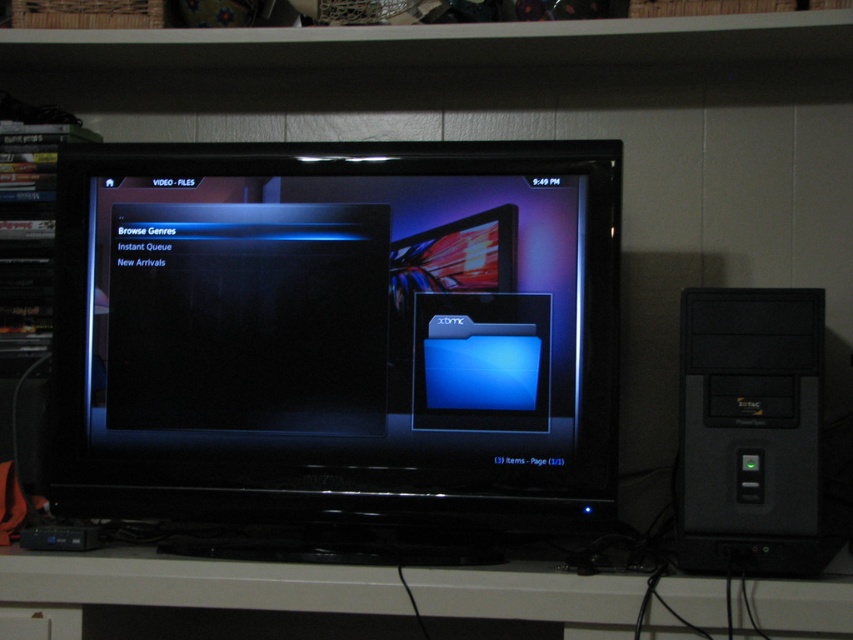
You are standing in front of the home entertainment setup and need to place a new device on the white matte computer desk at lower center. Given that the desk is at coordinates point (196, 582), can you confirm if there is enough space for the device?

The point (196, 582) marks the white matte computer desk at lower center, so yes, there is space available on the desk to place the new device.

You are setting up a home theater system and need to place a large AV receiver between the black glossy monitor at center and the black plastic desktop computer at right. Given that the AV receiver is 20 inches wide, can it fit in the space between them?

The black glossy monitor at center is larger than the black plastic desktop computer at right, but the description does not provide specific measurements of the space between them. Without knowing the exact distance, it is impossible to determine if the AV receiver will fit.

You are setting up a new entertainment system and need to place a black glossy monitor at center in your living room. Based on the image provided, what are the coordinates where you should position it?

The black glossy monitor at center should be positioned at coordinates point (337, 333) according to the image provided.